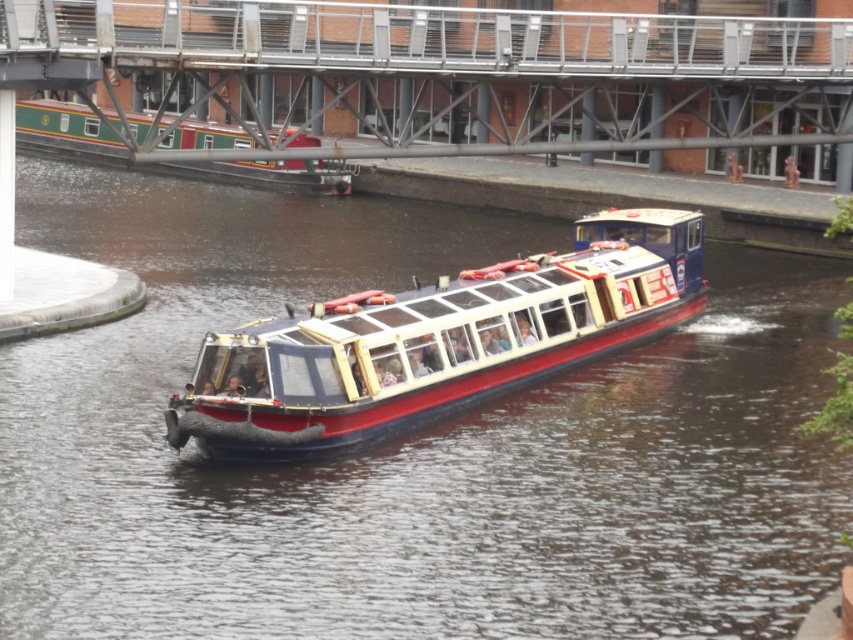
Question: Which point is closer to the camera?

Choices:
 (A) metallic gray bridge at upper center
 (B) green polished wood boat at upper left
 (C) red polished wood boat at center

Answer: (C)

Question: Is red polished wood boat at center further to the viewer compared to green polished wood boat at upper left?

Choices:
 (A) yes
 (B) no

Answer: (B)

Question: Among these objects, which one is farthest from the camera?

Choices:
 (A) green polished wood boat at upper left
 (B) metallic gray bridge at upper center
 (C) red polished wood boat at center

Answer: (A)

Question: Where is metallic gray bridge at upper center located in relation to red polished wood boat at center in the image?

Choices:
 (A) above
 (B) below

Answer: (A)

Question: Does metallic gray bridge at upper center have a smaller size compared to red polished wood boat at center?

Choices:
 (A) yes
 (B) no

Answer: (B)

Question: Estimate the real-world distances between objects in this image. Which object is farther from the green polished wood boat at upper left?

Choices:
 (A) red polished wood boat at center
 (B) metallic gray bridge at upper center

Answer: (A)